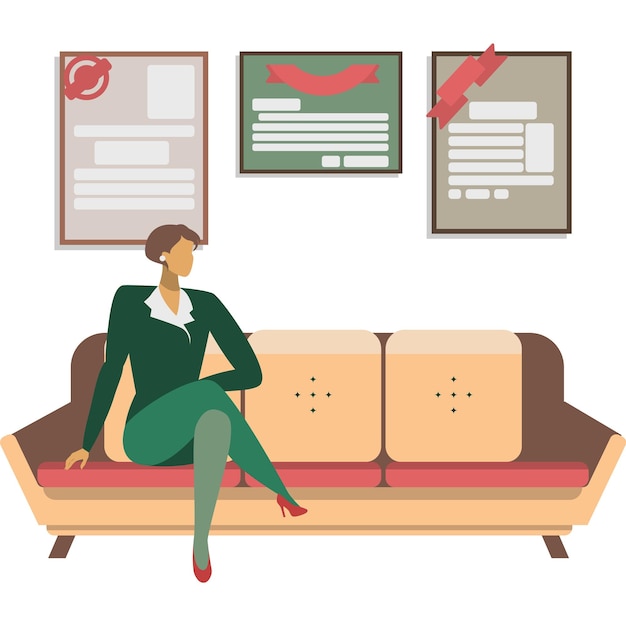
Image resolution: width=626 pixels, height=626 pixels. What are the coordinates of `back rest of the couch` in the screenshot? It's located at (538, 381).